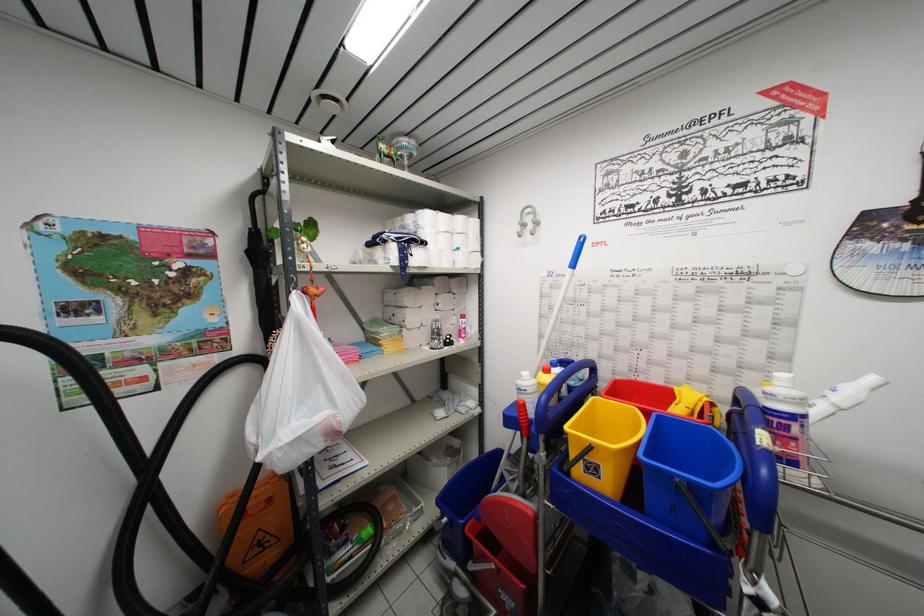
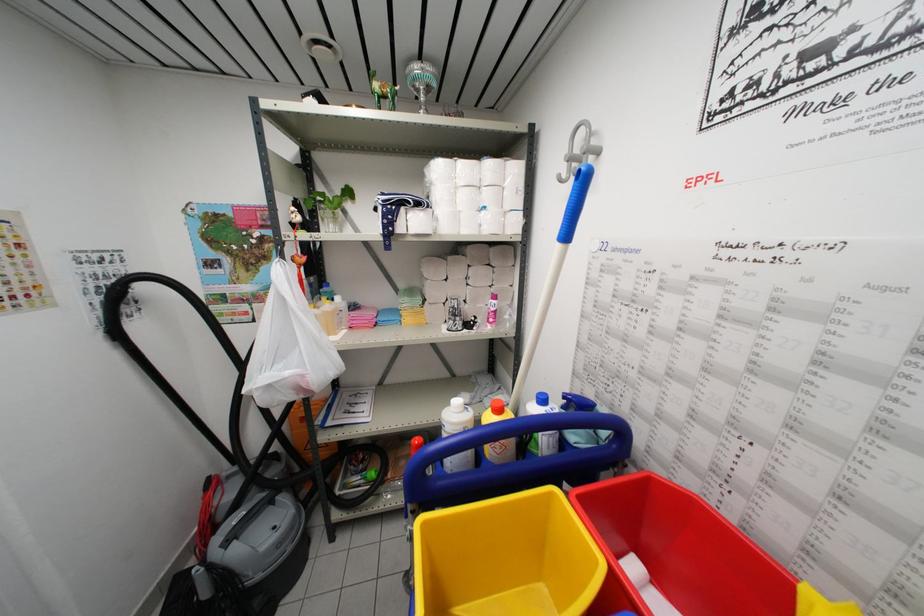
The point at (598, 405) is marked in the first image. Where is the corresponding point in the second image?

(554, 498)